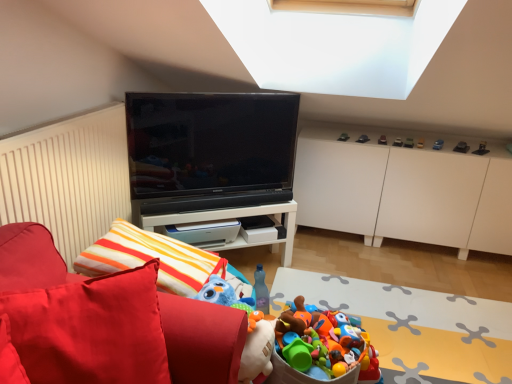
Where is `free space that is to the left of metallic black toy car at upper right, marked as the 9th toy in a top-to-bottom arrangement`? The image size is (512, 384). free space that is to the left of metallic black toy car at upper right, marked as the 9th toy in a top-to-bottom arrangement is located at coordinates click(x=452, y=146).